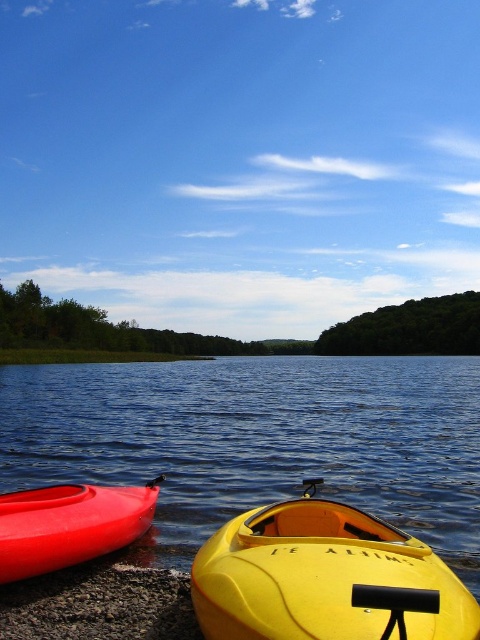
Question: Is yellow matte kayak at lower center below matte red canoe at lower left?

Choices:
 (A) yes
 (B) no

Answer: (B)

Question: Is blue glossy water at lower left thinner than yellow matte kayak at lower center?

Choices:
 (A) yes
 (B) no

Answer: (B)

Question: Which point is farther to the camera?

Choices:
 (A) yellow matte kayak at lower center
 (B) blue glossy water at lower left
 (C) matte red canoe at lower left

Answer: (B)

Question: Does blue glossy water at lower left have a lesser width compared to yellow matte kayak at lower center?

Choices:
 (A) no
 (B) yes

Answer: (A)

Question: Among these objects, which one is farthest from the camera?

Choices:
 (A) blue glossy water at lower left
 (B) yellow matte kayak at lower center
 (C) matte red canoe at lower left

Answer: (A)

Question: Among these objects, which one is nearest to the camera?

Choices:
 (A) matte red canoe at lower left
 (B) blue glossy water at lower left

Answer: (A)